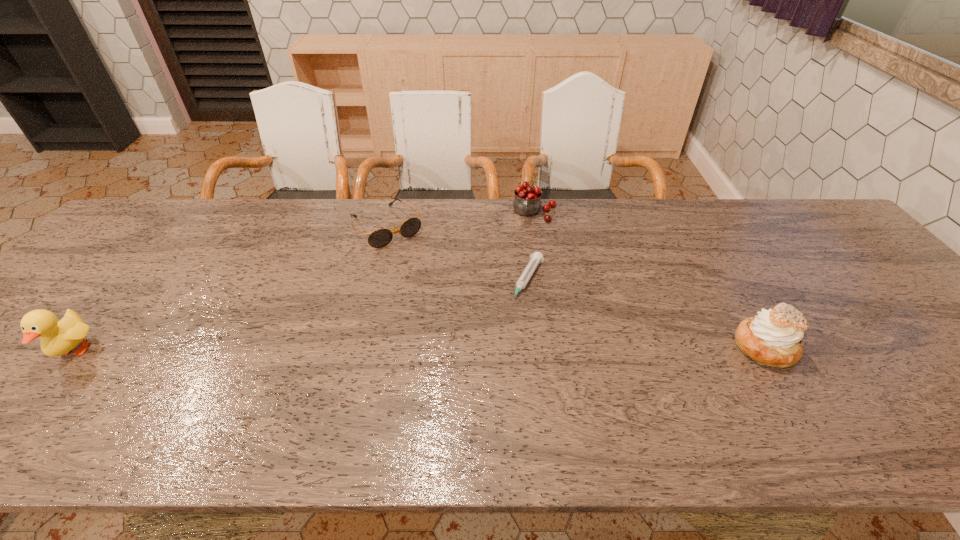
Identify the location of free spot located on the front-facing side of the sunglasses. The image size is (960, 540). (468, 328).

At what (x,y) coordinates should I click in order to perform the action: click on vacant space located on the front-facing side of the sunglasses. Please return your answer as a coordinate pair (x, y). Image resolution: width=960 pixels, height=540 pixels. Looking at the image, I should click on (445, 301).

You are a GUI agent. You are given a task and a screenshot of the screen. Output one action in this format:
    pyautogui.click(x=<x>, y=<y>)
    Task: Click on the free space located on the handle side of the pot filled with cherries
    The width and height of the screenshot is (960, 540).
    Given the screenshot: What is the action you would take?
    pyautogui.click(x=524, y=248)

At what (x,y) coordinates should I click in order to perform the action: click on free region located on the handle side of the pot filled with cherries. Please return your answer as a coordinate pair (x, y). The height and width of the screenshot is (540, 960). Looking at the image, I should click on (512, 302).

What are the coordinates of `vacant region located 0.080m on the handle side of the pot filled with cherries` in the screenshot? It's located at (526, 240).

What are the coordinates of `vacant region located at the needle end of the shortest object` in the screenshot? It's located at (502, 338).

Identify the location of free space located 0.320m at the needle end of the shortest object. The width and height of the screenshot is (960, 540). (464, 407).

Where is `blank area located 0.270m at the needle end of the shortest object`? The image size is (960, 540). blank area located 0.270m at the needle end of the shortest object is located at coordinates (474, 388).

Where is `sunglasses that is at the far edge`? The width and height of the screenshot is (960, 540). sunglasses that is at the far edge is located at coordinates (379, 238).

Locate an element on the screen. The image size is (960, 540). pot filled with cherries positioned at the far edge is located at coordinates (527, 201).